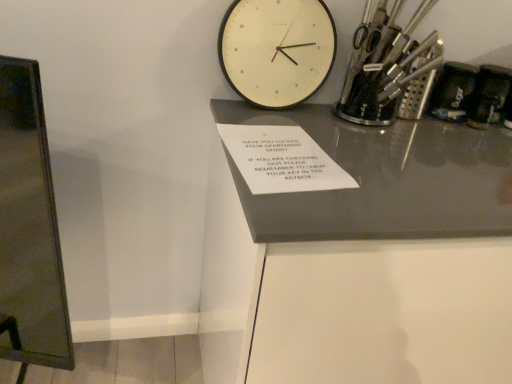
Locate an element on the screen. This screenshot has width=512, height=384. free point below metallic silver utensils at upper right, which is the 2th stationery from right to left (from a real-world perspective) is located at coordinates (369, 111).